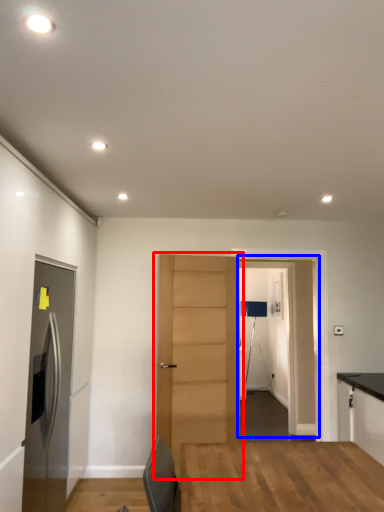
Question: Which of the following is the closest to the observer, door (highlighted by a red box) or glass door (highlighted by a blue box)?

Choices:
 (A) door
 (B) glass door

Answer: (A)